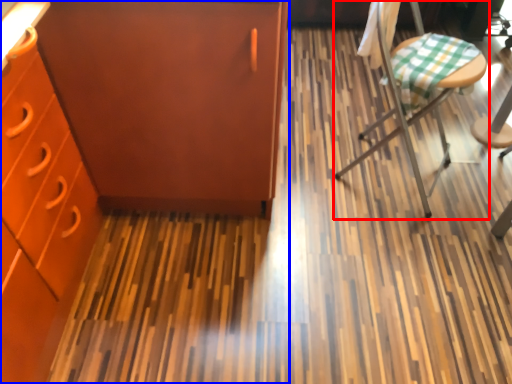
Question: Among these objects, which one is farthest to the camera, chair (highlighted by a red box) or cabinetry (highlighted by a blue box)?

Choices:
 (A) chair
 (B) cabinetry

Answer: (A)